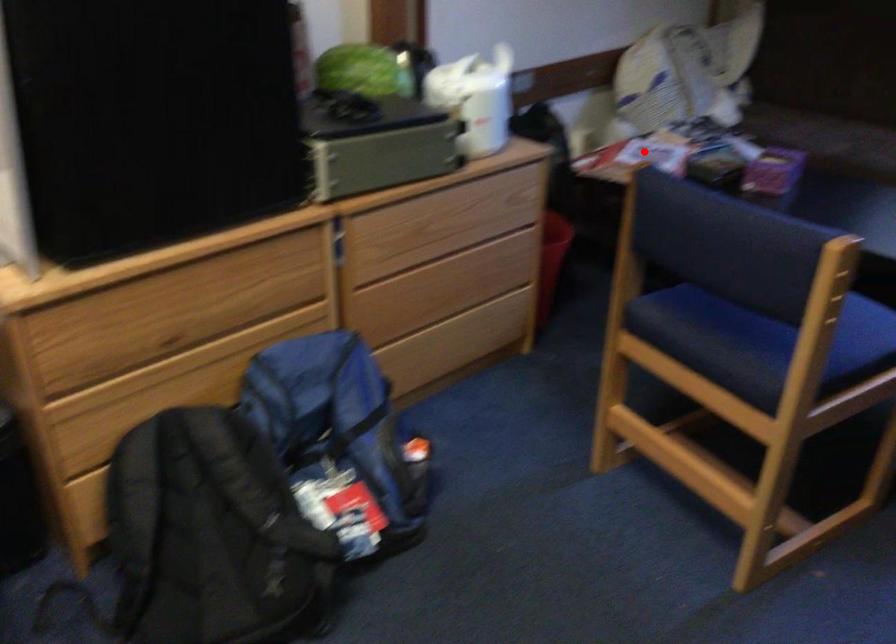
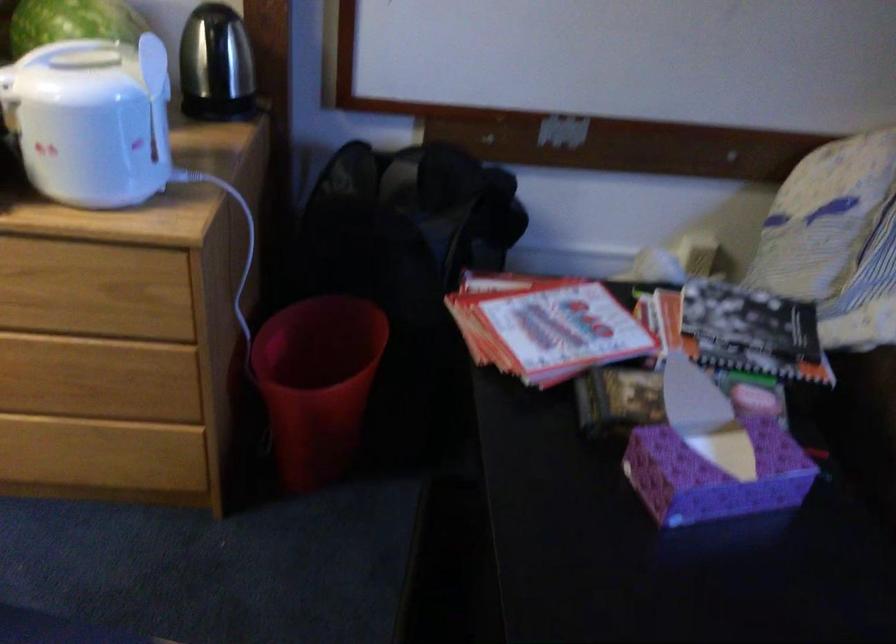
Locate, in the second image, the point that corresponds to the highlighted location in the first image.

(545, 326)